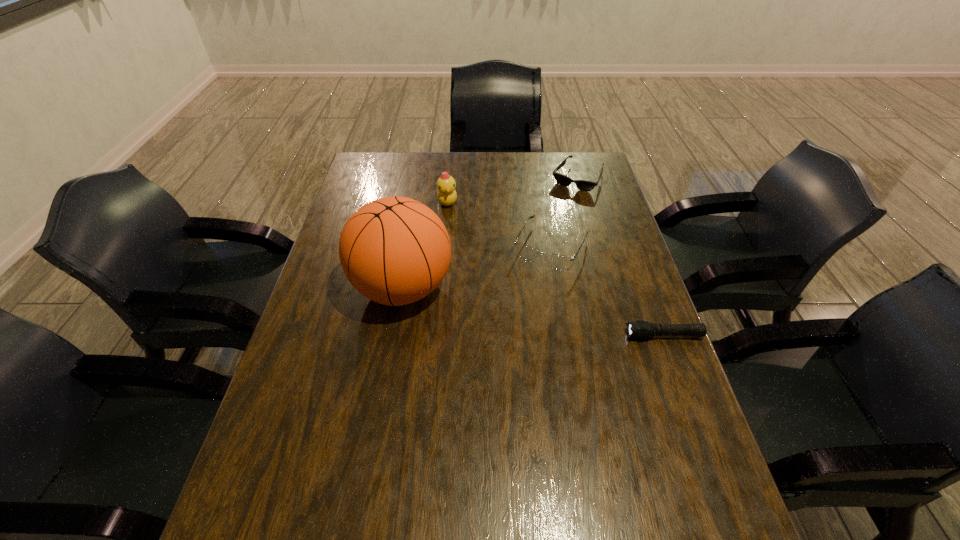
Image resolution: width=960 pixels, height=540 pixels. Find the location of `vacant region located on the front-facing side of the spectacles`. vacant region located on the front-facing side of the spectacles is located at coordinates (529, 287).

Image resolution: width=960 pixels, height=540 pixels. In order to click on vacant position located 0.220m on the front-facing side of the spectacles in this screenshot , I will do `click(508, 326)`.

This screenshot has height=540, width=960. Find the location of `blank space located 0.180m on the front-facing side of the second tallest object`. blank space located 0.180m on the front-facing side of the second tallest object is located at coordinates (481, 241).

You are a GUI agent. You are given a task and a screenshot of the screen. Output one action in this format:
    pyautogui.click(x=<x>, y=<y>)
    Task: Click on the free space located on the front-facing side of the second tallest object
    This screenshot has height=540, width=960.
    Given the screenshot: What is the action you would take?
    pyautogui.click(x=493, y=253)

At what (x,y) coordinates should I click in order to perform the action: click on vacant space positioned on the front-facing side of the second tallest object. Please return your answer as a coordinate pair (x, y). The image size is (960, 540). Looking at the image, I should click on (465, 224).

I want to click on vacant space located on the front-facing side of the sunglasses, so click(543, 234).

The width and height of the screenshot is (960, 540). Find the location of `blank space located 0.360m on the front-facing side of the sunglasses`. blank space located 0.360m on the front-facing side of the sunglasses is located at coordinates click(x=531, y=255).

This screenshot has height=540, width=960. I want to click on free space located 0.160m on the front-facing side of the sunglasses, so click(x=553, y=218).

In order to click on object situated at the far edge in this screenshot , I will do `click(583, 185)`.

At what (x,y) coordinates should I click in order to perform the action: click on object that is at the left edge. Please return your answer as a coordinate pair (x, y). The image size is (960, 540). Looking at the image, I should click on (394, 250).